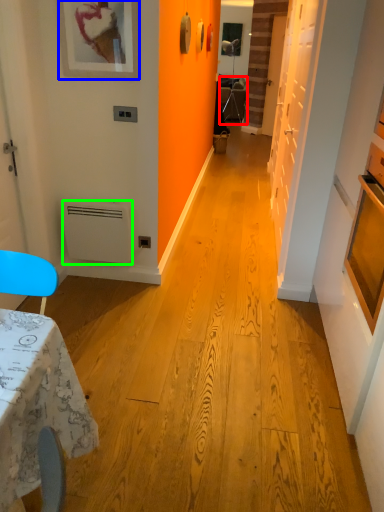
Question: Estimate the real-world distances between objects in this image. Which object is closer to armchair (highlighted by a red box), picture frame (highlighted by a blue box) or appliance (highlighted by a green box)?

Choices:
 (A) picture frame
 (B) appliance

Answer: (A)